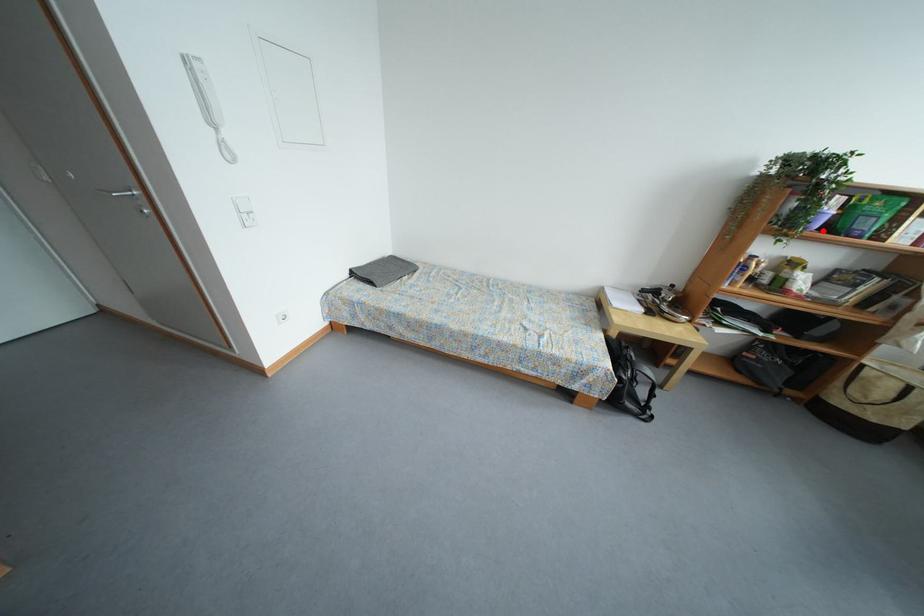
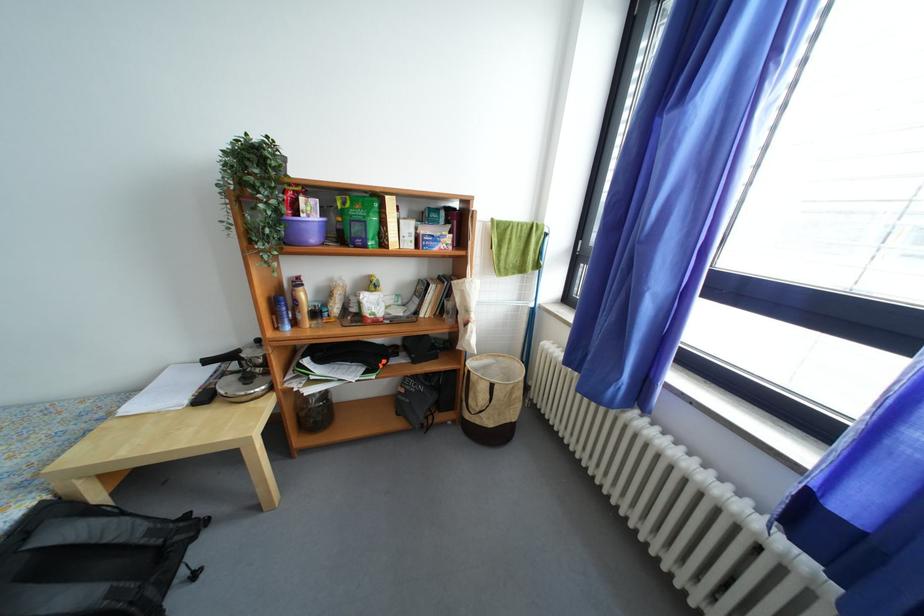
Question: I am providing you with two images of the same scene from different viewpoints. Given a red point in image1, look at the same physical point in image2. Is it:

Choices:
 (A) Closer to the viewpoint
 (B) Farther from the viewpoint

Answer: (A)